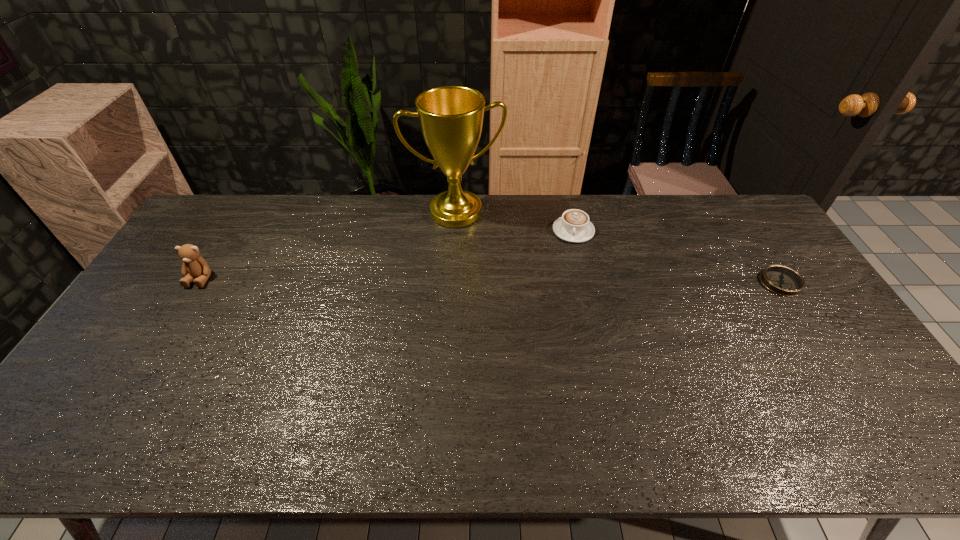
Image resolution: width=960 pixels, height=540 pixels. I want to click on free space between the third shortest object and the award, so click(x=328, y=245).

Where is `vacant area between the third tallest object and the rightmost object`? The width and height of the screenshot is (960, 540). vacant area between the third tallest object and the rightmost object is located at coordinates tap(677, 256).

The width and height of the screenshot is (960, 540). In order to click on empty location between the teddy bear and the tallest object in this screenshot , I will do `click(328, 245)`.

Where is `free space between the rightmost object and the third object from left to right`? The image size is (960, 540). free space between the rightmost object and the third object from left to right is located at coordinates (677, 256).

Where is `object that can be found as the closest to the compass`? This screenshot has width=960, height=540. object that can be found as the closest to the compass is located at coordinates (574, 226).

Identify the location of object that is the third closest to the compass. The image size is (960, 540). (194, 265).

The height and width of the screenshot is (540, 960). I want to click on blank area in the image that satisfies the following two spatial constraints: 1. on the front-facing side of the compass; 2. on the left side of the third shortest object, so click(x=198, y=282).

Identify the location of free space in the image that satisfies the following two spatial constraints: 1. on the front side of the third object from left to right; 2. on the right side of the award. Image resolution: width=960 pixels, height=540 pixels. (454, 231).

Locate an element on the screen. vacant area that satisfies the following two spatial constraints: 1. on the front side of the award; 2. on the left side of the cappuccino is located at coordinates (454, 231).